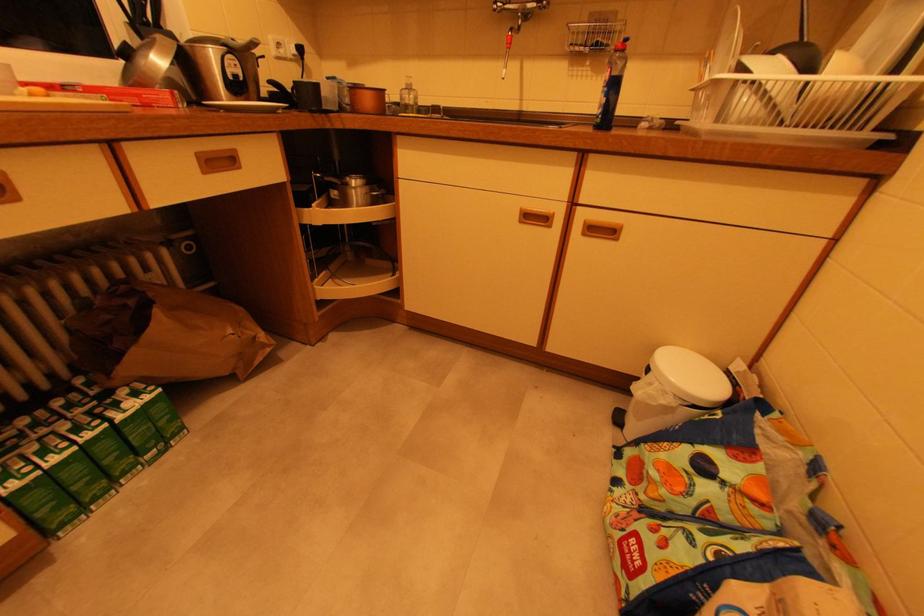
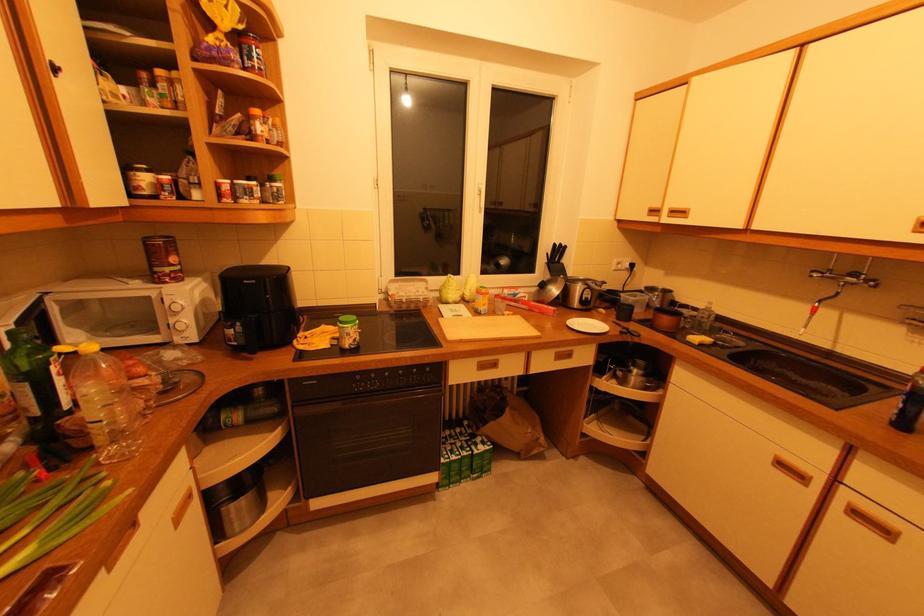
Where in the second image is the point corresponding to [349,185] from the first image?

(634, 371)